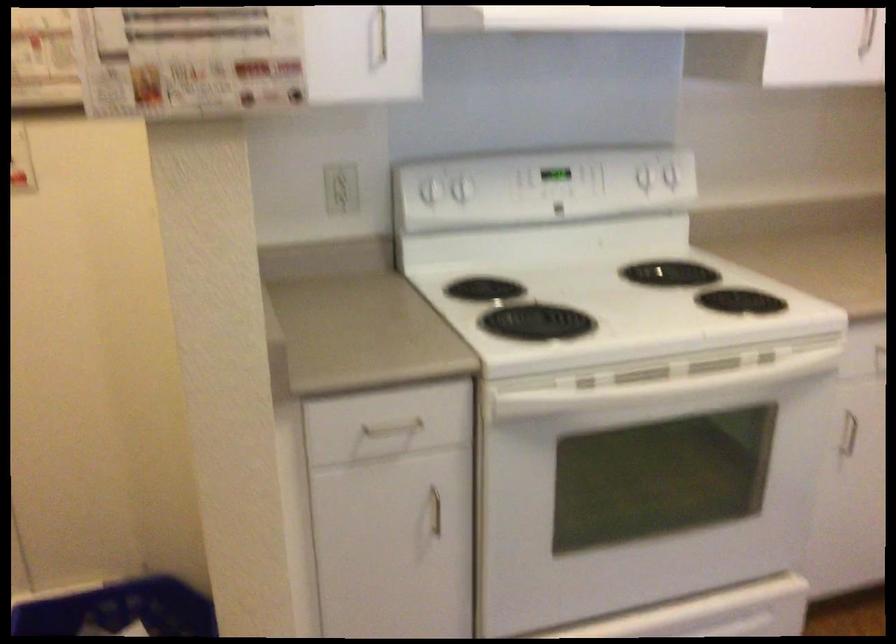
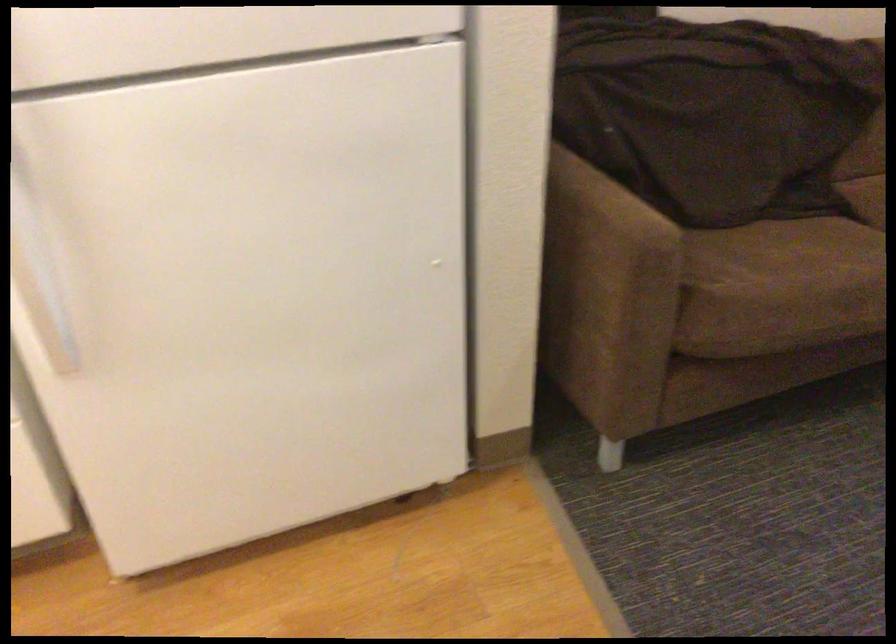
First-person continuous shooting, in which direction is the camera rotating?

The rotation direction of the camera is right-down.